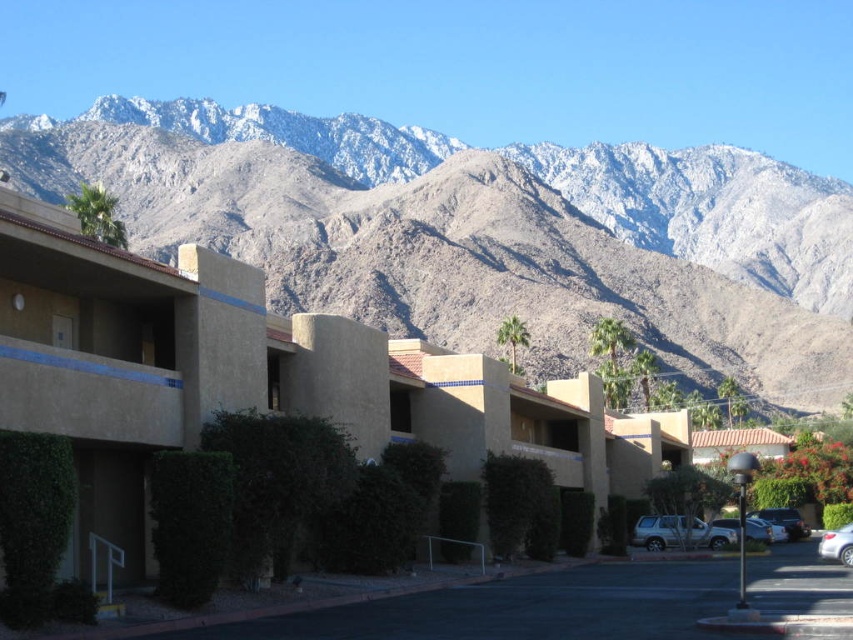
Question: Which point appears farthest from the camera in this image?

Choices:
 (A) (512, 531)
 (B) (32, 131)
 (C) (161, 536)

Answer: (B)

Question: Where is gray rocky mountain range at upper center located in relation to green leafy hedge at center in the image?

Choices:
 (A) left
 (B) right

Answer: (A)

Question: Which of the following is the closest to the observer?

Choices:
 (A) matte silver suv at center
 (B) green leafy hedge at center
 (C) gray rocky mountain range at upper center

Answer: (B)

Question: Does gray rocky mountain range at upper center have a greater width compared to green leafy hedge at center?

Choices:
 (A) yes
 (B) no

Answer: (A)

Question: Can you confirm if green leafy hedge at center is positioned to the right of matte silver suv at center?

Choices:
 (A) yes
 (B) no

Answer: (B)

Question: Estimate the real-world distances between objects in this image. Which object is closer to the matte silver suv at center?

Choices:
 (A) white glossy sedan at lower right
 (B) green leafy hedge at lower left

Answer: (A)